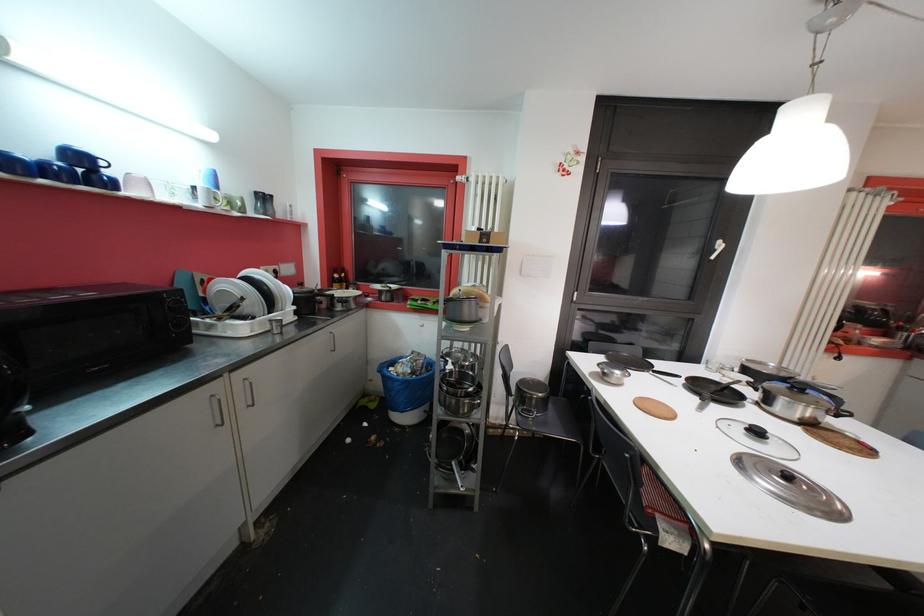
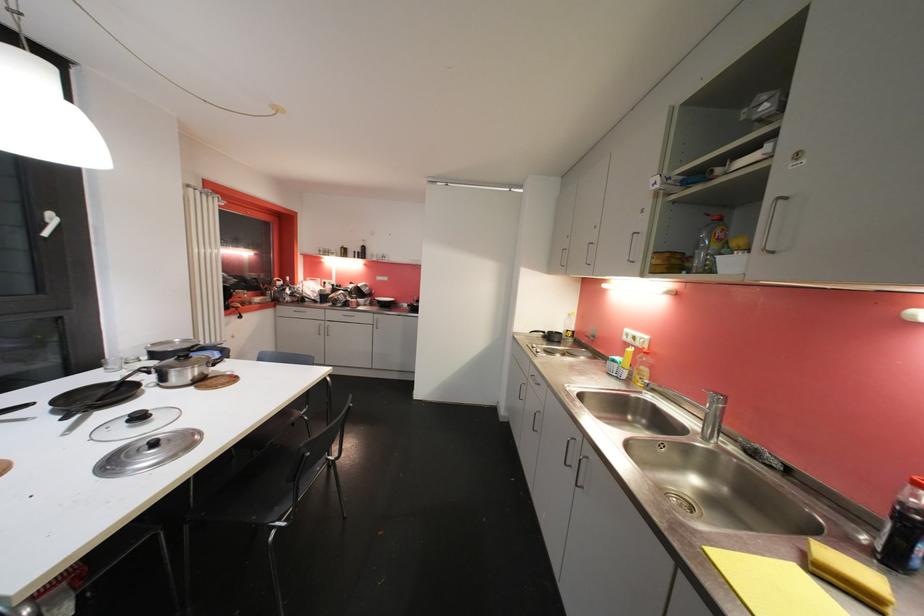
Question: The images are taken continuously from a first-person perspective. In which direction is your viewpoint rotating?

Choices:
 (A) Left
 (B) Right
 (C) Up
 (D) Down

Answer: (B)